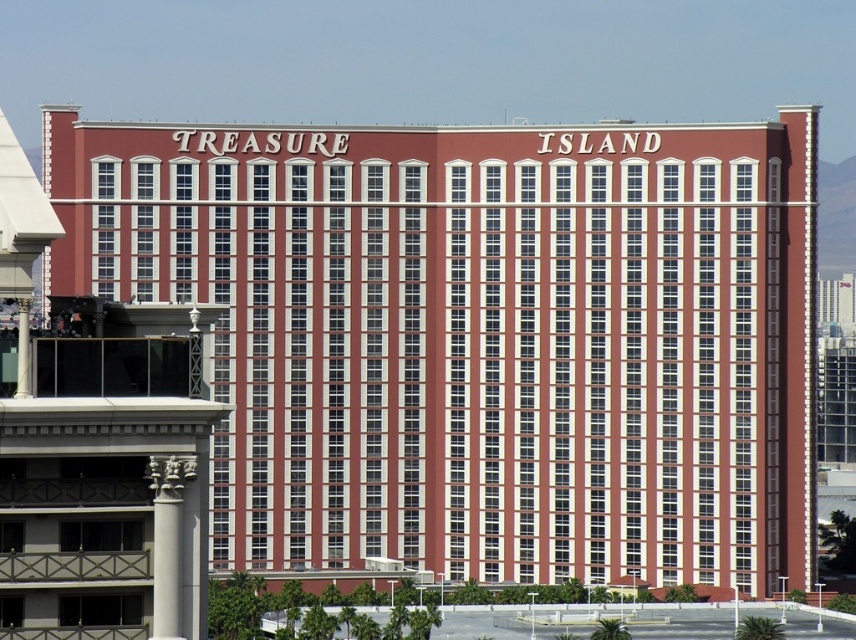
Between red brick building at center and white glossy column at lower left, which one has more height?

red brick building at center

Is point (438, 300) positioned after point (183, 467)?

Yes, point (438, 300) is farther from viewer.

Locate an element on the screen. Image resolution: width=856 pixels, height=640 pixels. red brick building at center is located at coordinates (480, 337).